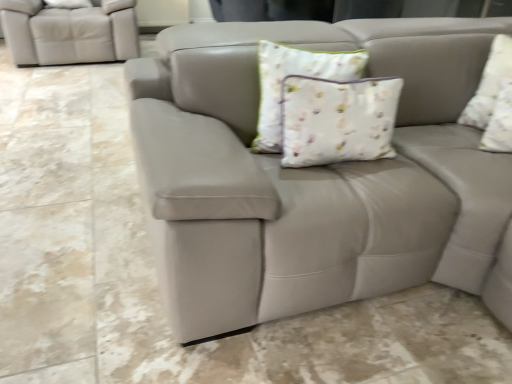
Question: Is matte leather couch at center in front of or behind white floral fabric pillow at upper right, arranged as the first pillow when viewed from the right, in the image?

Choices:
 (A) front
 (B) behind

Answer: (A)

Question: Considering the positions of matte leather couch at center and white floral fabric pillow at upper right, the 2th pillow viewed from the left, in the image, is matte leather couch at center wider or thinner than white floral fabric pillow at upper right, the 2th pillow viewed from the left,?

Choices:
 (A) wide
 (B) thin

Answer: (A)

Question: Estimate the real-world distances between objects in this image. Which object is farther from the matte leather couch at center?

Choices:
 (A) white floral fabric pillow at upper right, the 2th pillow viewed from the left
 (B) white floral fabric pillow at center, the second pillow viewed from the right

Answer: (A)

Question: Based on their relative distances, which object is nearer to the white floral fabric pillow at center, the second pillow viewed from the right?

Choices:
 (A) white floral fabric pillow at upper right, the 2th pillow viewed from the left
 (B) matte leather couch at center

Answer: (B)